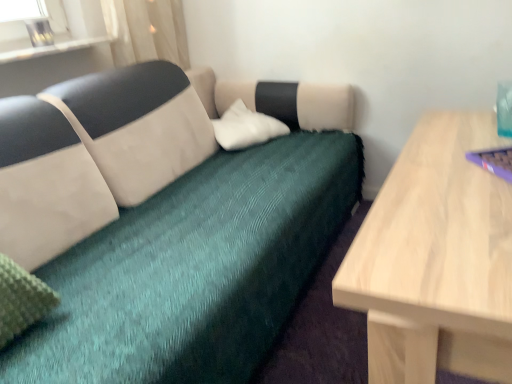
Question: Does teal fabric couch at center lie behind white soft pillow at center?

Choices:
 (A) yes
 (B) no

Answer: (B)

Question: Would you say teal fabric couch at center is outside white soft pillow at center?

Choices:
 (A) yes
 (B) no

Answer: (A)

Question: Is teal fabric couch at center in contact with white soft pillow at center?

Choices:
 (A) no
 (B) yes

Answer: (A)

Question: Considering the relative sizes of teal fabric couch at center and white soft pillow at center in the image provided, is teal fabric couch at center taller than white soft pillow at center?

Choices:
 (A) yes
 (B) no

Answer: (A)

Question: Does teal fabric couch at center come in front of white soft pillow at center?

Choices:
 (A) yes
 (B) no

Answer: (A)

Question: Relative to clear glass vase at upper left, is sheer white curtain at upper left in front or behind?

Choices:
 (A) front
 (B) behind

Answer: (B)

Question: From the image's perspective, is sheer white curtain at upper left above or below clear glass vase at upper left?

Choices:
 (A) below
 (B) above

Answer: (B)

Question: From a real-world perspective, relative to clear glass vase at upper left, is sheer white curtain at upper left vertically above or below?

Choices:
 (A) below
 (B) above

Answer: (A)

Question: From their relative heights in the image, would you say sheer white curtain at upper left is taller or shorter than clear glass vase at upper left?

Choices:
 (A) tall
 (B) short

Answer: (A)

Question: In the image, is sheer white curtain at upper left on the left side or the right side of purple plastic laptop at right?

Choices:
 (A) left
 (B) right

Answer: (A)

Question: Would you say sheer white curtain at upper left is inside or outside purple plastic laptop at right?

Choices:
 (A) outside
 (B) inside

Answer: (A)

Question: Relative to purple plastic laptop at right, is sheer white curtain at upper left in front or behind?

Choices:
 (A) front
 (B) behind

Answer: (B)

Question: In terms of width, does sheer white curtain at upper left look wider or thinner when compared to purple plastic laptop at right?

Choices:
 (A) wide
 (B) thin

Answer: (A)

Question: Is teal fabric couch at center spatially inside purple plastic laptop at right, or outside of it?

Choices:
 (A) outside
 (B) inside

Answer: (A)

Question: Considering the positions of teal fabric couch at center and purple plastic laptop at right in the image, is teal fabric couch at center wider or thinner than purple plastic laptop at right?

Choices:
 (A) thin
 (B) wide

Answer: (B)